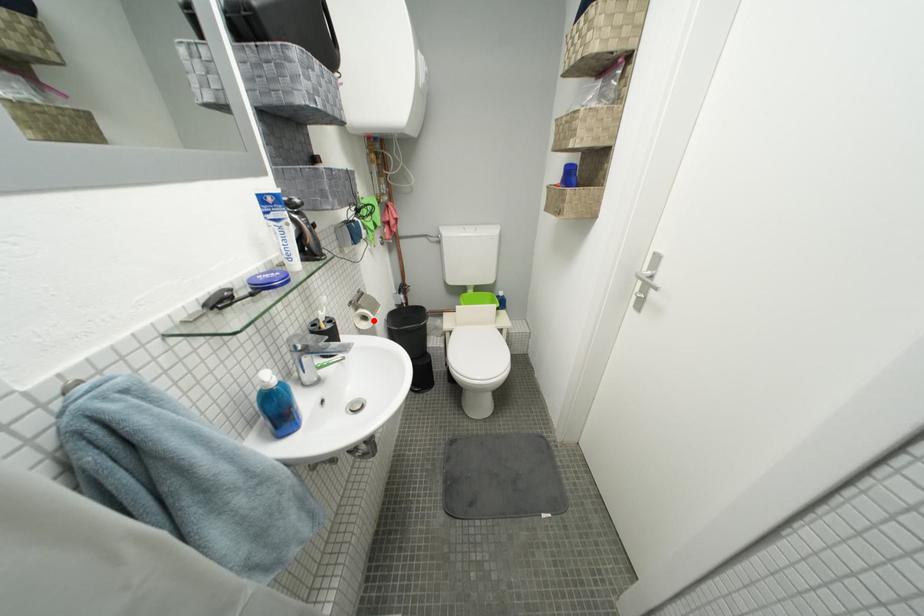
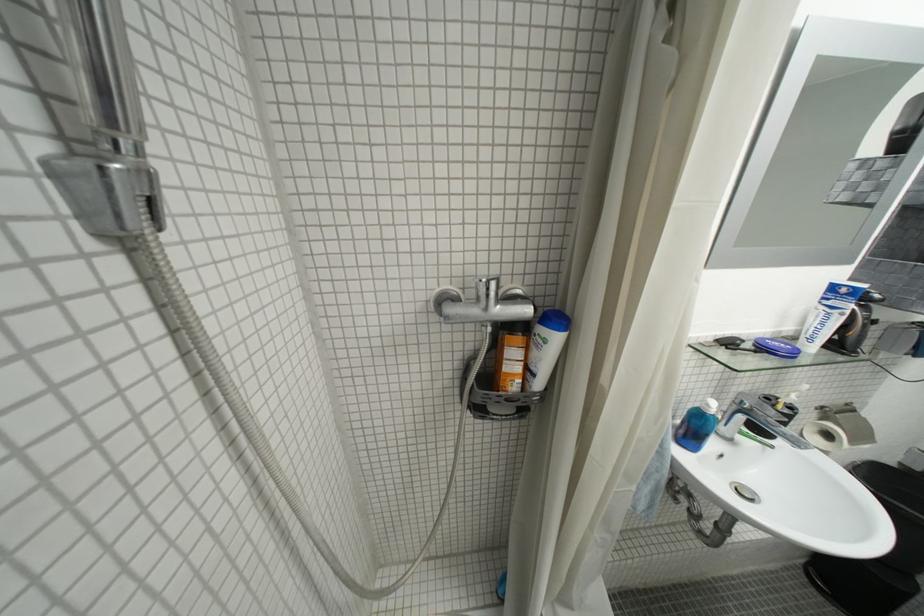
Locate, in the second image, the point that corresponds to the highlighted location in the first image.

(836, 438)